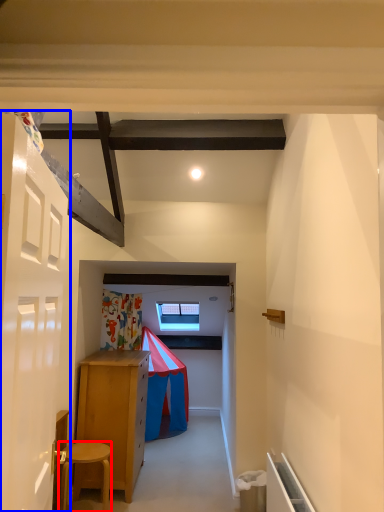
Question: Among these objects, which one is nearest to the camera, stool (highlighted by a red box) or door (highlighted by a blue box)?

Choices:
 (A) stool
 (B) door

Answer: (B)